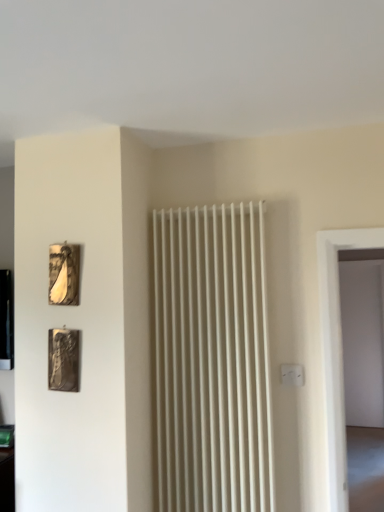
Question: From the image's perspective, would you say metallic silver picture frame at lower left, the second picture frame viewed from the top, is positioned over white plastic electric outlet at center-right?

Choices:
 (A) no
 (B) yes

Answer: (B)

Question: Is metallic silver picture frame at lower left, which is counted as the 1th picture frame, starting from the bottom, shorter than white plastic electric outlet at center-right?

Choices:
 (A) no
 (B) yes

Answer: (A)

Question: Is metallic silver picture frame at lower left, which is counted as the 1th picture frame, starting from the bottom, wider than white plastic electric outlet at center-right?

Choices:
 (A) yes
 (B) no

Answer: (A)

Question: Is metallic silver picture frame at lower left, which is counted as the 1th picture frame, starting from the bottom, directly adjacent to white plastic electric outlet at center-right?

Choices:
 (A) yes
 (B) no

Answer: (B)

Question: Is white plastic electric outlet at center-right a part of metallic silver picture frame at lower left, which is counted as the 1th picture frame, starting from the bottom?

Choices:
 (A) no
 (B) yes

Answer: (A)

Question: From a real-world perspective, is metallic silver picture frame at lower left, which is counted as the 1th picture frame, starting from the bottom, physically below white plastic electric outlet at center-right?

Choices:
 (A) yes
 (B) no

Answer: (B)

Question: Does metallic gold picture frame at upper left, placed as the 1th picture frame when sorted from top to bottom, lie behind metallic silver picture frame at lower left, which is counted as the 1th picture frame, starting from the bottom?

Choices:
 (A) yes
 (B) no

Answer: (A)

Question: Is metallic gold picture frame at upper left, placed as the 1th picture frame when sorted from top to bottom, wider than metallic silver picture frame at lower left, the second picture frame viewed from the top?

Choices:
 (A) no
 (B) yes

Answer: (A)

Question: From a real-world perspective, is metallic gold picture frame at upper left, arranged as the 2th picture frame when ordered from the bottom, physically above metallic silver picture frame at lower left, which is counted as the 1th picture frame, starting from the bottom?

Choices:
 (A) no
 (B) yes

Answer: (B)

Question: Would you say metallic gold picture frame at upper left, placed as the 1th picture frame when sorted from top to bottom, is a long distance from metallic silver picture frame at lower left, the second picture frame viewed from the top?

Choices:
 (A) no
 (B) yes

Answer: (A)

Question: Is metallic gold picture frame at upper left, arranged as the 2th picture frame when ordered from the bottom, at the left side of metallic silver picture frame at lower left, which is counted as the 1th picture frame, starting from the bottom?

Choices:
 (A) yes
 (B) no

Answer: (A)

Question: Considering the relative sizes of metallic gold picture frame at upper left, placed as the 1th picture frame when sorted from top to bottom, and metallic silver picture frame at lower left, the second picture frame viewed from the top, in the image provided, is metallic gold picture frame at upper left, placed as the 1th picture frame when sorted from top to bottom, shorter than metallic silver picture frame at lower left, the second picture frame viewed from the top,?

Choices:
 (A) yes
 (B) no

Answer: (A)

Question: Is metallic silver picture frame at lower left, the second picture frame viewed from the top, completely or partially outside of metallic gold picture frame at upper left, arranged as the 2th picture frame when ordered from the bottom?

Choices:
 (A) yes
 (B) no

Answer: (A)